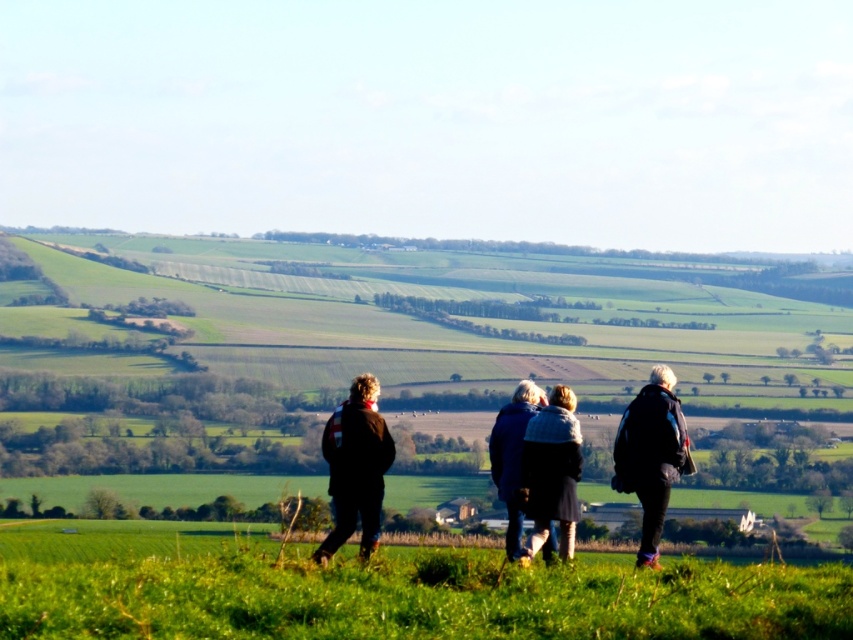
Based on the photo, you are planning to take a group photo of the four individuals walking on the green grassy field at lower center and wearing the blue woolen sweater at center. Since the field is wider than the sweater, will the entire group fit within the field in the photo?

The green grassy field at lower center is wider than the blue woolen sweater at center, so the entire group wearing the blue woolen sweater at center can fit within the field in the photo since the field is wider.

You are a photographer trying to capture a group of people walking in a rural landscape. You notice two individuals wearing dark blue jacket at center and blue woolen sweater at center. Which clothing item is closer to your camera lens?

The dark blue jacket at center is closer to the camera lens because it is further to the viewer than the blue woolen sweater at center.